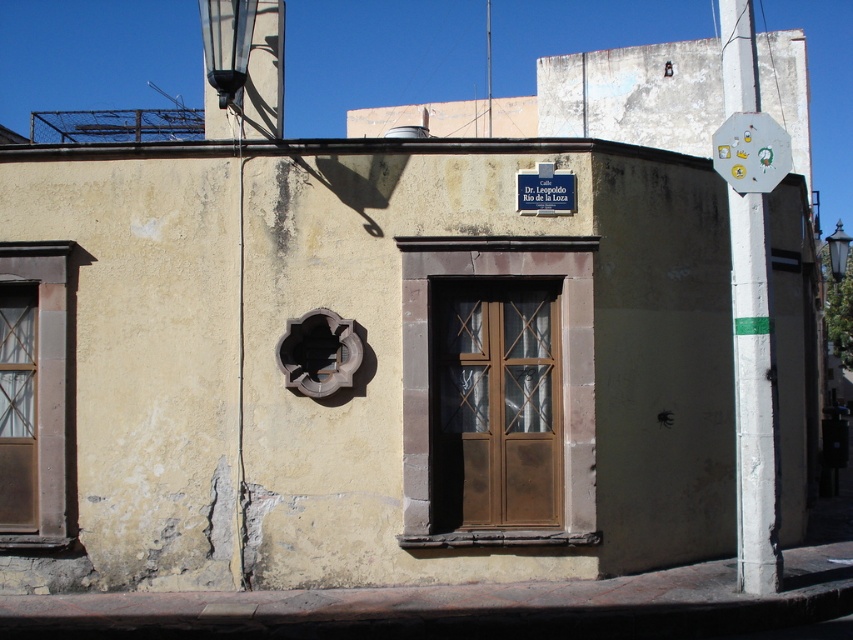
You are a delivery person trying to place a large package in front of the brown wooden door at center. The package is 1.2 meters wide. Can the package fit through the doorway next to the matte brown window at left?

The brown wooden door at center has a smaller size compared to matte brown window at left. Since the door is smaller than the window, the doorway might be narrower than the window. However, without knowing the exact dimensions of the doorway, it is uncertain if the 1.2 meter wide package can fit through. The delivery person should measure the doorway width before attempting to move the package.

You are an architect assessing the building facade. You need to install a new sign that is the same width as the metallic octagonal sign at upper right. Which object on the facade can you use as a reference to ensure the new sign is narrower than the matte brown window at left?

The matte brown window at left is wider than the metallic octagonal sign at upper right. Therefore, you can use the metallic octagonal sign at upper right as a reference to ensure the new sign is narrower than the matte brown window at left.